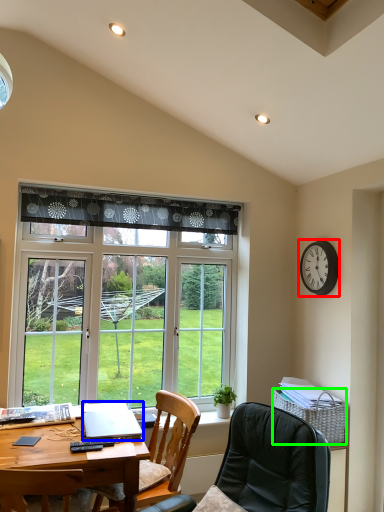
Question: Which is nearer to the clock (highlighted by a red box)? laptop (highlighted by a blue box) or picnic basket (highlighted by a green box).

Choices:
 (A) laptop
 (B) picnic basket

Answer: (B)